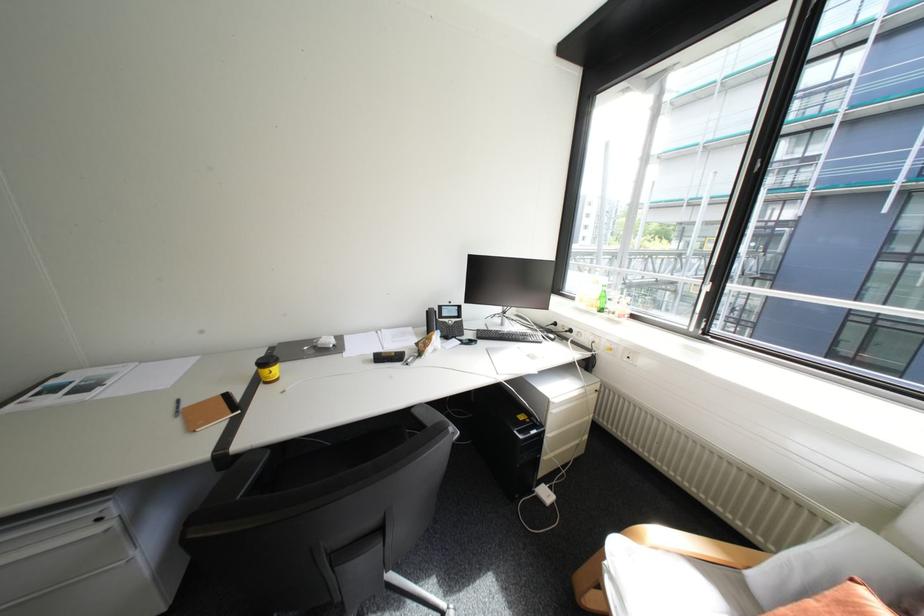
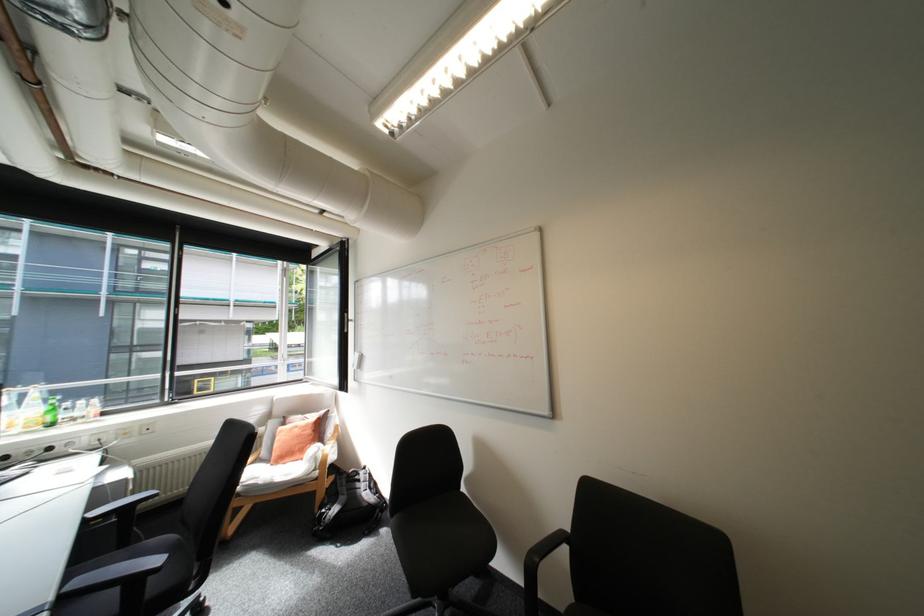
Locate, in the second image, the point that corresponds to the point at 598,306 in the first image.

(38, 427)